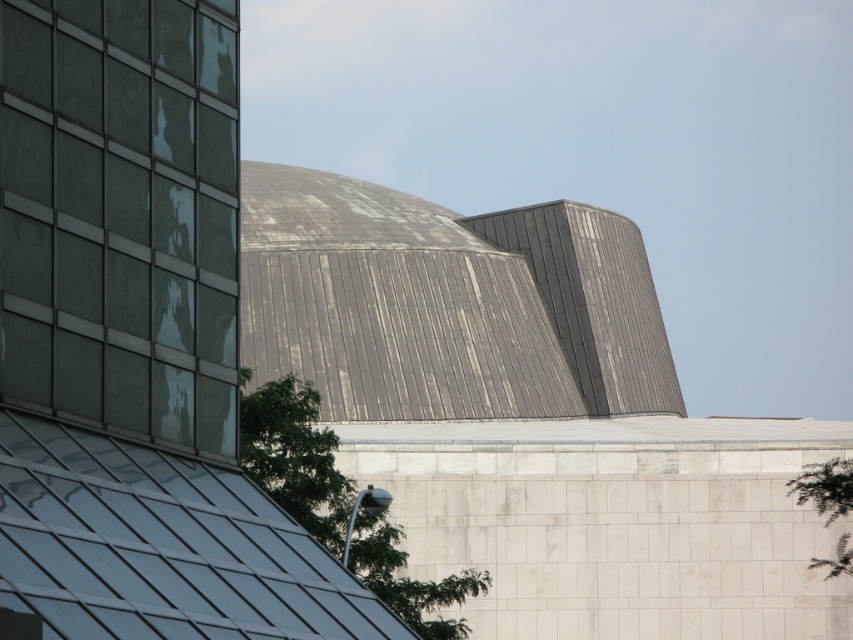
You are standing in front of the modern architectural structure and notice two green leafy trees. Which tree, the green leafy tree at center or the green leafy tree at lower right, is taller?

The green leafy tree at center is taller than the green leafy tree at lower right.

You are standing in front of the modern architectural structure and want to take a photo. You notice two points marked on the glass facade. Which of the two points, point (289, 483) or point (836, 548), is closer to your camera lens?

Point (289, 483) is closer to the camera than point (836, 548), so it will appear larger in your photo.